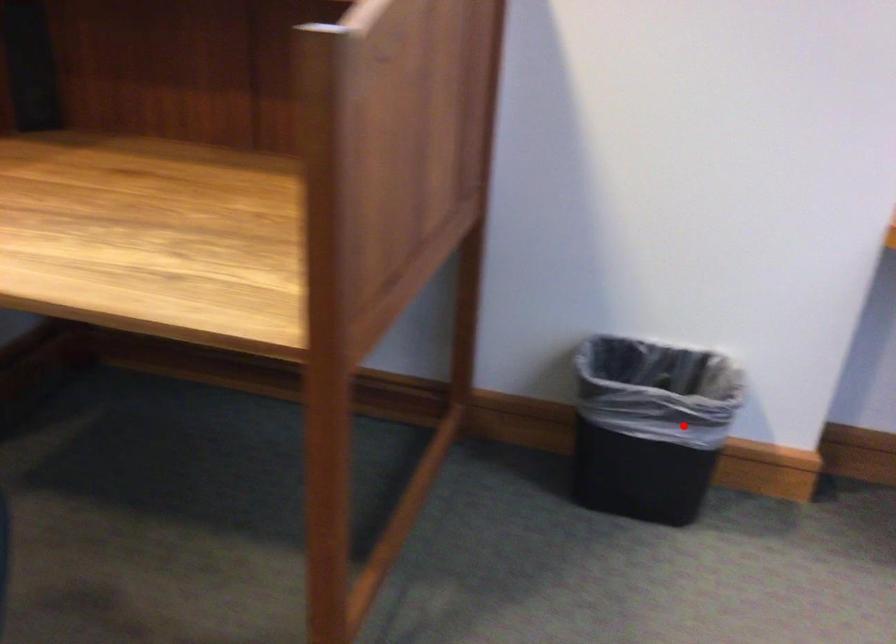
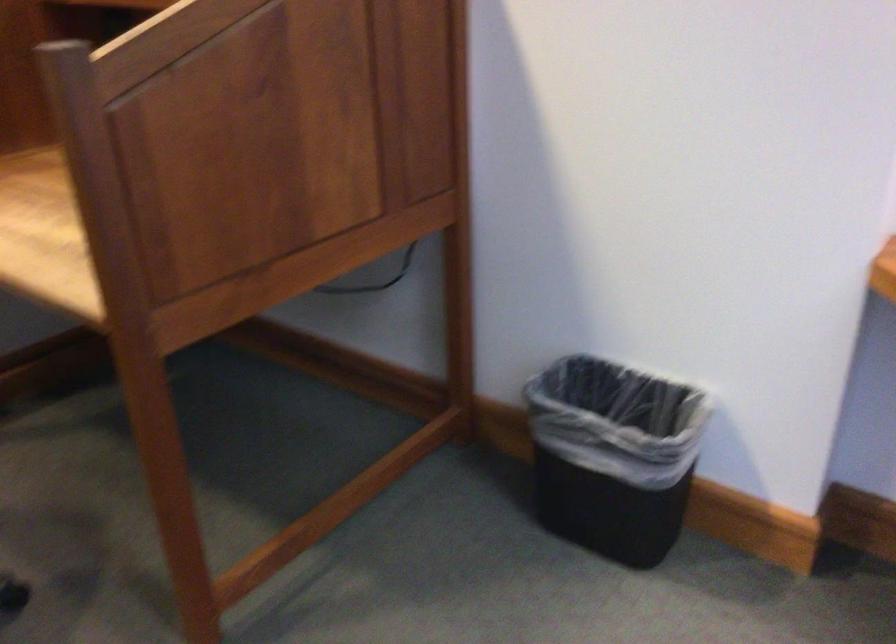
The point at the highlighted location is marked in the first image. Where is the corresponding point in the second image?

(613, 456)